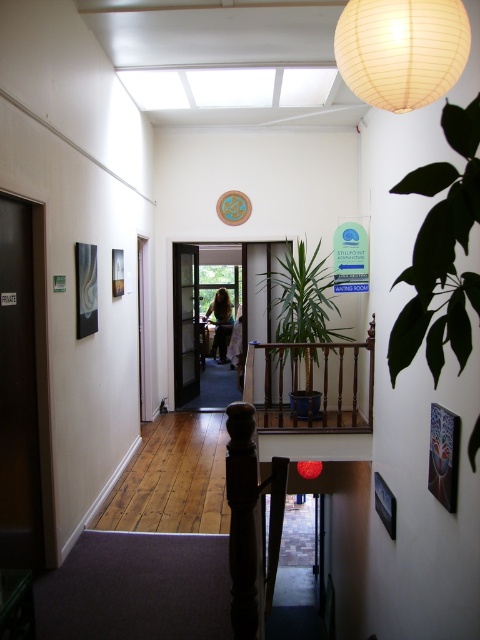
Question: Does green leafy plant at right appear over ivory paper lantern at upper center?

Choices:
 (A) yes
 (B) no

Answer: (B)

Question: Can you confirm if green leafy plant at right is positioned to the right of blonde hair at center?

Choices:
 (A) no
 (B) yes

Answer: (B)

Question: Does green leafy plant at right appear on the left side of ivory paper lantern at upper center?

Choices:
 (A) yes
 (B) no

Answer: (B)

Question: Which point appears farthest from the camera in this image?

Choices:
 (A) (383, 108)
 (B) (214, 289)
 (C) (219, 292)

Answer: (B)

Question: Among these objects, which one is nearest to the camera?

Choices:
 (A) green leafy plant at right
 (B) ivory paper lantern at upper center

Answer: (A)

Question: Which of these objects is positioned closest to the blonde hair at center?

Choices:
 (A) wooden at center
 (B) green leafy plant at right
 (C) green leafy plant at center

Answer: (C)